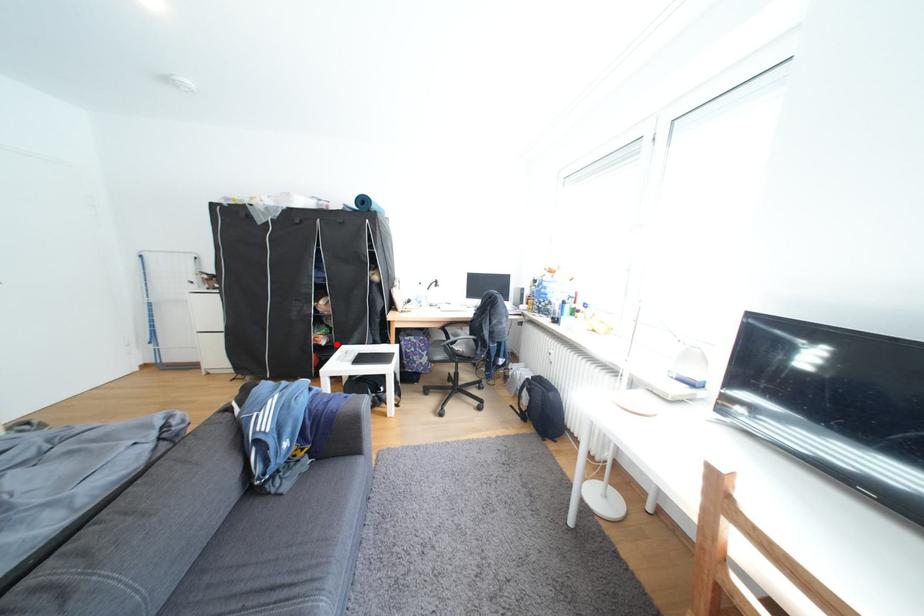
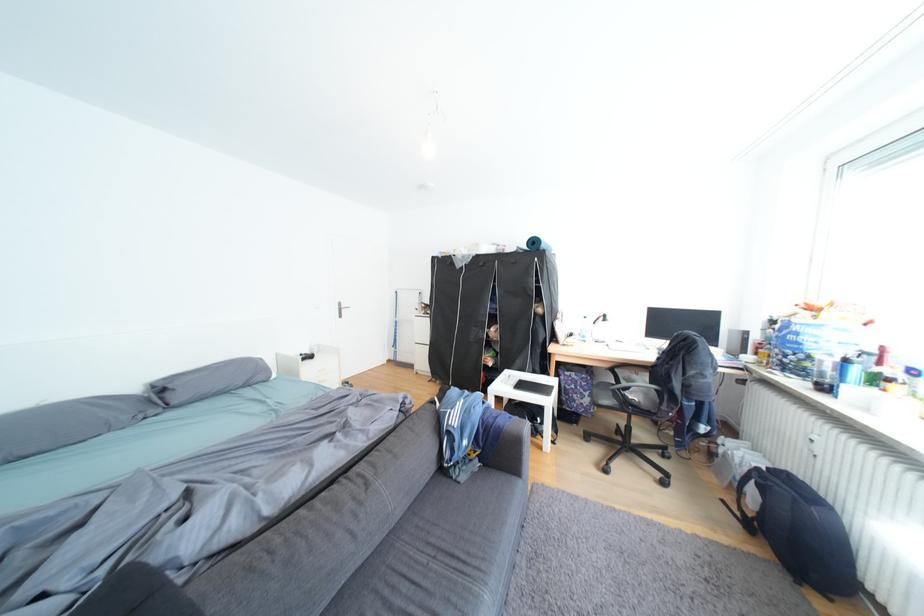
Locate, in the second image, the point that corresponds to the highlighted location in the first image.

(504, 365)